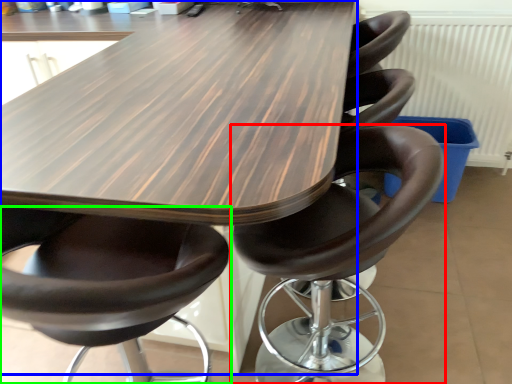
Question: Which is nearer to the chair (highlighted by a red box)? table (highlighted by a blue box) or chair (highlighted by a green box).

Choices:
 (A) table
 (B) chair

Answer: (B)